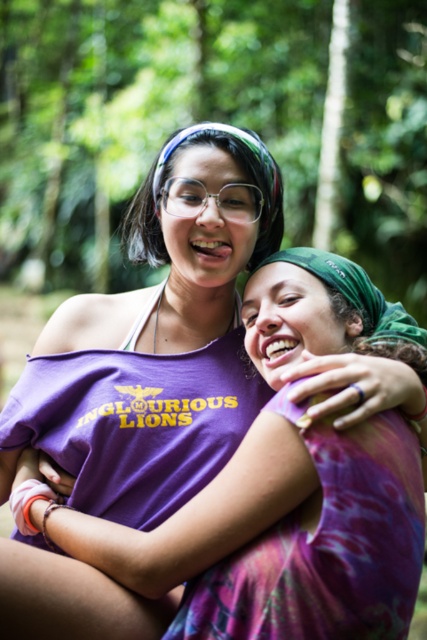
Between point (40, 540) and point (193, 193), which one is positioned behind?

Point (193, 193)

Does purple cotton shirt at center have a larger size compared to clear plastic glasses at center?

Yes.

You are a GUI agent. You are given a task and a screenshot of the screen. Output one action in this format:
    pyautogui.click(x=<x>, y=<y>)
    Task: Click on the purple cotton shirt at center
    The image size is (427, 640).
    Given the screenshot: What is the action you would take?
    pyautogui.click(x=356, y=300)

At what (x,y) coordinates should I click in order to perform the action: click on purple cotton shirt at center. Please return your answer as a coordinate pair (x, y). The width and height of the screenshot is (427, 640). Looking at the image, I should click on (356, 300).